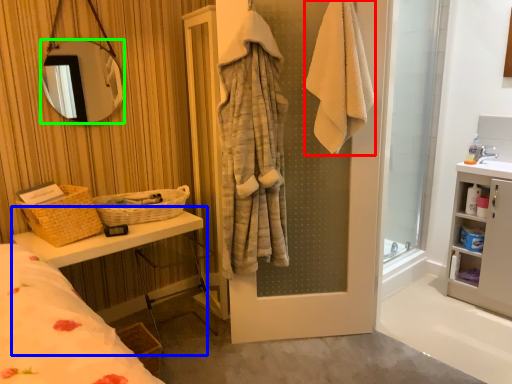
Question: Considering the real-world distances, which object is closest to bath towel (highlighted by a red box)? vanity (highlighted by a blue box) or mirror (highlighted by a green box).

Choices:
 (A) vanity
 (B) mirror

Answer: (A)